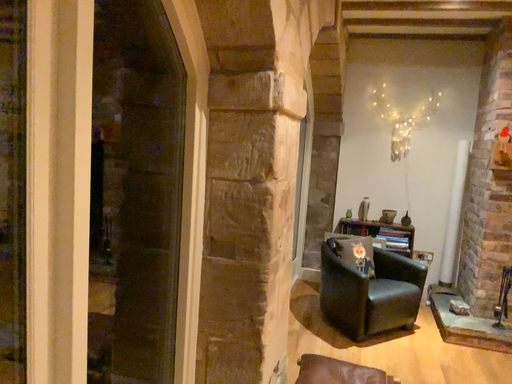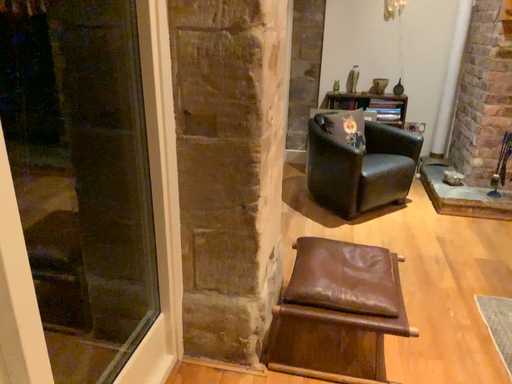
Question: How did the camera likely rotate when shooting the video?

Choices:
 (A) rotated downward
 (B) rotated upward

Answer: (A)